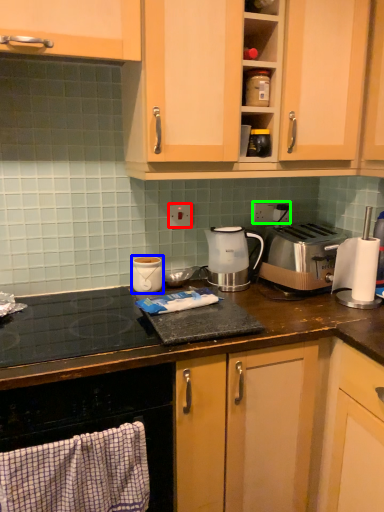
Question: Considering the real-world distances, which object is closest to electric outlet (highlighted by a red box)? kitchen appliance (highlighted by a blue box) or electric outlet (highlighted by a green box).

Choices:
 (A) kitchen appliance
 (B) electric outlet

Answer: (A)